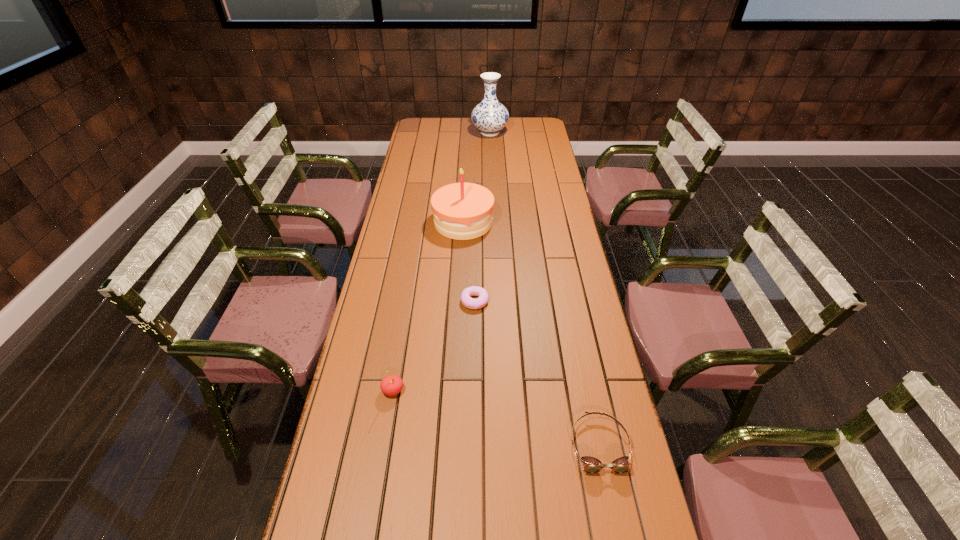
Locate an element on the screen. This screenshot has height=540, width=960. the farthest object is located at coordinates [489, 116].

Locate an element on the screen. The image size is (960, 540). vase is located at coordinates (489, 116).

Where is `the fourth shortest object`? The height and width of the screenshot is (540, 960). the fourth shortest object is located at coordinates (462, 211).

Find the location of a particular element. The height and width of the screenshot is (540, 960). birthday cake is located at coordinates (462, 211).

You are a GUI agent. You are given a task and a screenshot of the screen. Output one action in this format:
    pyautogui.click(x=<x>, y=<y>)
    Task: Click on the cherry
    This screenshot has height=540, width=960.
    Given the screenshot: What is the action you would take?
    pyautogui.click(x=391, y=385)

Locate an element on the screen. The image size is (960, 540). the fourth farthest object is located at coordinates (391, 385).

You are a GUI agent. You are given a task and a screenshot of the screen. Output one action in this format:
    pyautogui.click(x=<x>, y=<y>)
    Task: Click on the goggles
    The image size is (960, 540).
    Given the screenshot: What is the action you would take?
    pyautogui.click(x=591, y=465)

At what (x,y) coordinates should I click in order to perform the action: click on the fourth tallest object. Please return your answer as a coordinate pair (x, y). This screenshot has height=540, width=960. Looking at the image, I should click on (591, 465).

Where is `the third nearest object`? This screenshot has height=540, width=960. the third nearest object is located at coordinates (467, 301).

Identify the location of doughnut. This screenshot has height=540, width=960. (467, 301).